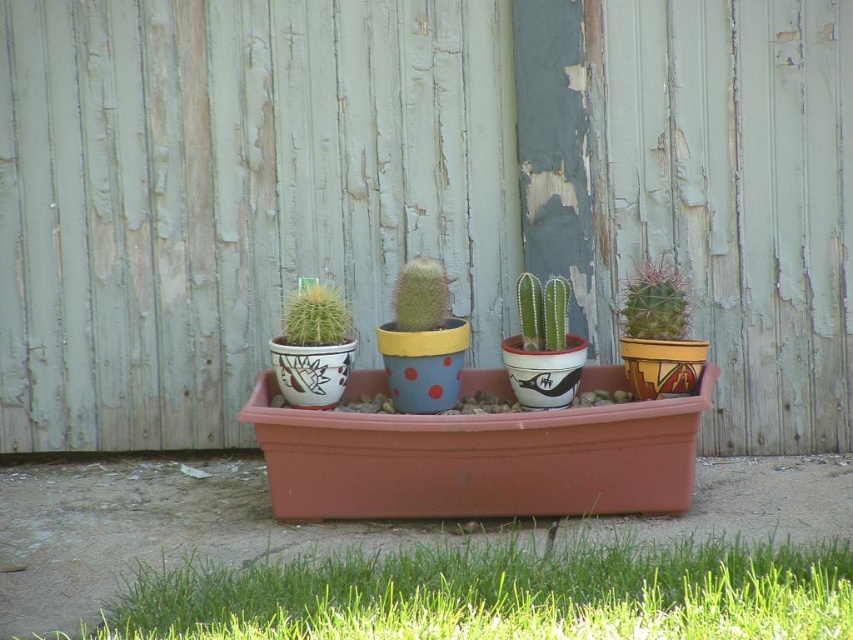
Question: Which of the following is the closest to the observer?

Choices:
 (A) green matte cactus at center
 (B) green fuzzy cactus at center

Answer: (B)

Question: Is sandy brown textured cactus at center to the right of matte ceramic cactus at center from the viewer's perspective?

Choices:
 (A) yes
 (B) no

Answer: (A)

Question: Which of the following is the closest to the observer?

Choices:
 (A) green matte cactus at center
 (B) sandy brown textured cactus at center
 (C) green matte cactus at lower center

Answer: (C)

Question: Does sandy brown textured cactus at center have a greater width compared to green matte cactus at center?

Choices:
 (A) no
 (B) yes

Answer: (B)

Question: Observing the image, what is the correct spatial positioning of matte ceramic cactus at center in reference to green fuzzy cactus at center?

Choices:
 (A) above
 (B) below

Answer: (B)

Question: Estimate the real-world distances between objects in this image. Which object is farther from the green matte cactus at lower center?

Choices:
 (A) sandy brown textured cactus at center
 (B) green fuzzy cactus at center
 (C) matte ceramic cactus at center

Answer: (A)